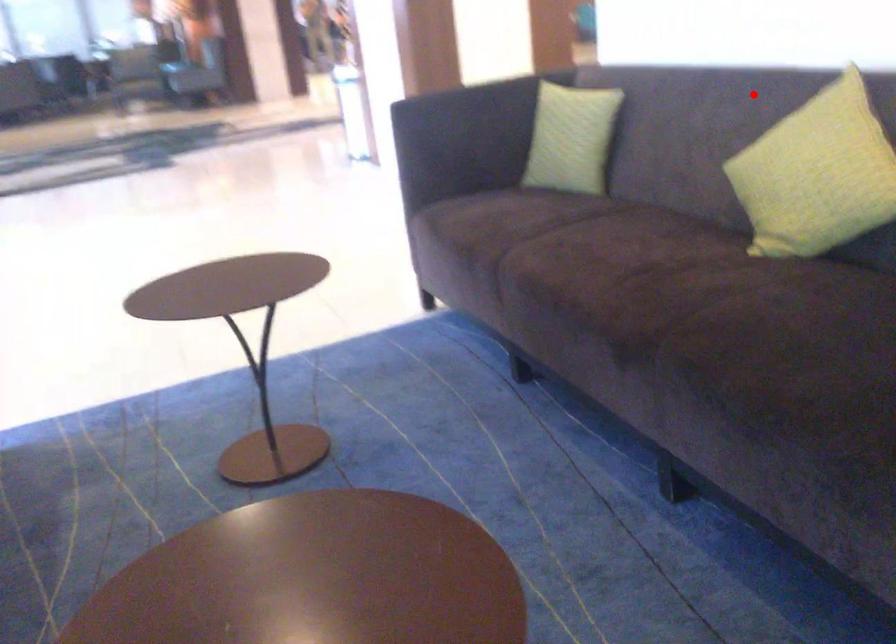
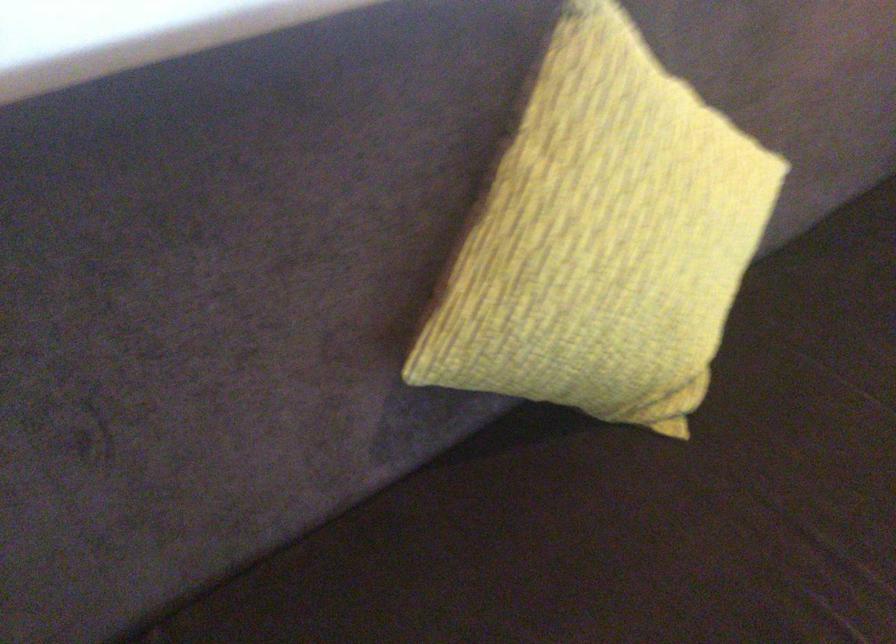
Where in the second image is the point corresponding to the highlighted location from the first image?

(231, 210)